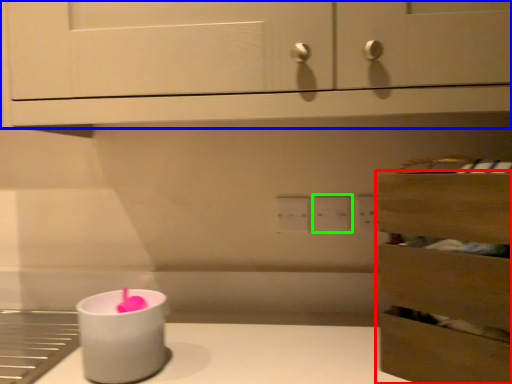
Question: Based on their relative distances, which object is nearer to drawer (highlighted by a red box)? Choose from cabinetry (highlighted by a blue box) and electric outlet (highlighted by a green box).

Choices:
 (A) cabinetry
 (B) electric outlet

Answer: (A)